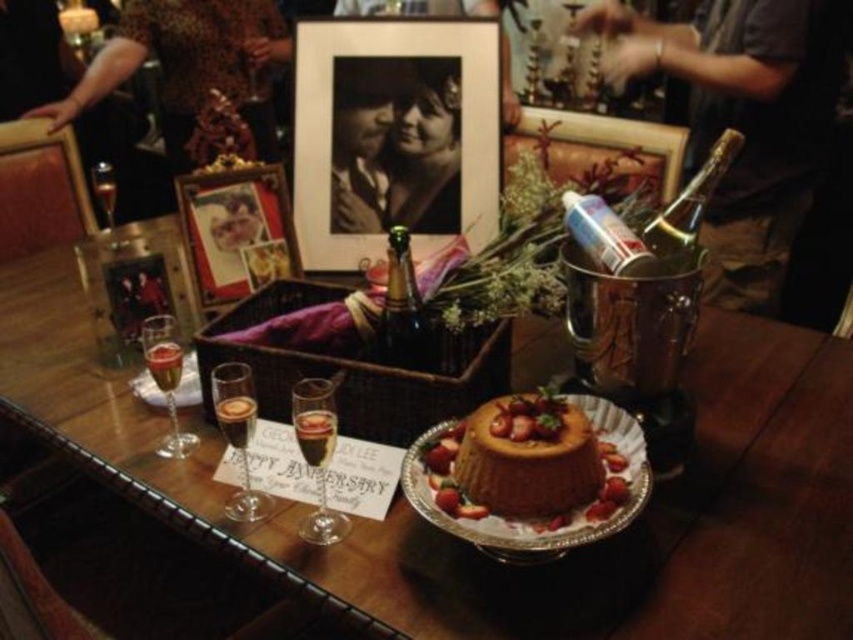
You are organizing a closet and need to place the leather jacket at upper left and the matte black photo frame at upper center. Given their sizes, which item should you place first to ensure both fit properly?

The leather jacket at upper left is larger in size than the matte black photo frame at upper center, so you should place the leather jacket at upper left first to accommodate its larger size before placing the smaller matte black photo frame at upper center.

You are a guest at the table and want to reach for the champagne glass closest to you. Which of the two points, point (x=712, y=83) or point (x=503, y=410), is closer to your position?

Point (x=503, y=410) is closer to your position because it is in front of point (x=712, y=83), which is behind it.

You are a waiter at a restaurant and need to serve both the metallic silver wine at upper right and the golden sponge cake at center to a customer. Since the customer has limited space on their table, which item should you place first to ensure both fit?

The golden sponge cake at center should be placed first because the metallic silver wine at upper right is larger in size and requires more space. By placing the smaller item first, there will be enough room left for the larger one.